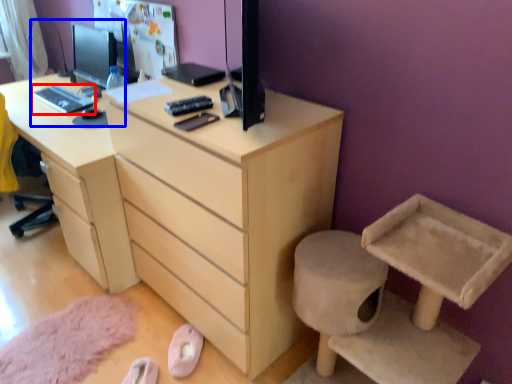
Question: Which point is closer to the camera, desktop (highlighted by a red box) or desktop computer (highlighted by a blue box)?

Choices:
 (A) desktop
 (B) desktop computer

Answer: (B)